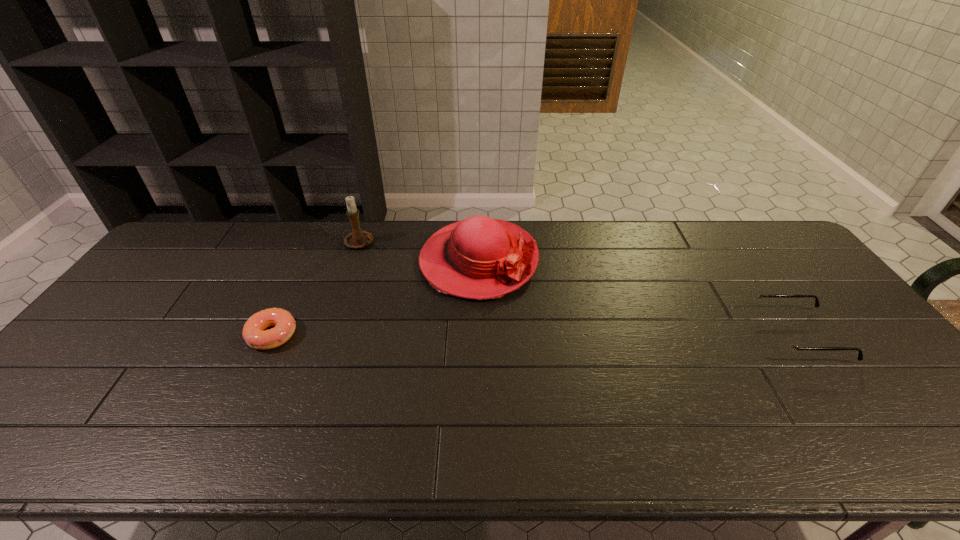
Locate an element on the screen. The image size is (960, 540). free space on the desktop that is between the doughnut and the rightmost object and is positioned at the front of the third object from left to right with a bow is located at coordinates (564, 335).

Where is `free space on the desktop that is between the leftmost object and the second shortest object and is positioned on the side of the candle holder with the handle`? The height and width of the screenshot is (540, 960). free space on the desktop that is between the leftmost object and the second shortest object and is positioned on the side of the candle holder with the handle is located at coordinates (465, 335).